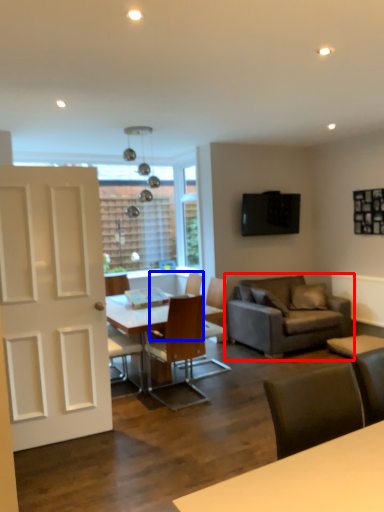
Question: Which point is further to the camera, studio couch (highlighted by a red box) or chair (highlighted by a blue box)?

Choices:
 (A) studio couch
 (B) chair

Answer: (A)